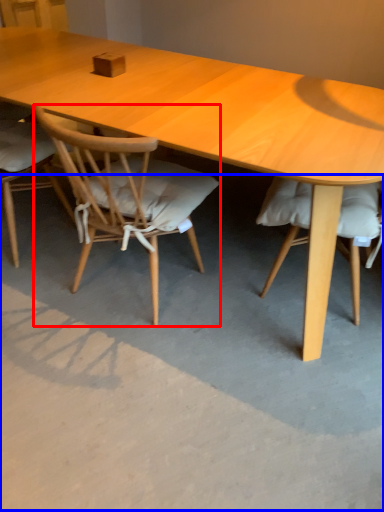
Question: Which point is further to the camera, chair (highlighted by a red box) or concrete (highlighted by a blue box)?

Choices:
 (A) chair
 (B) concrete

Answer: (A)